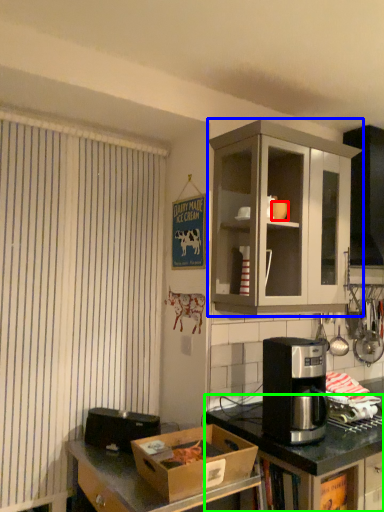
Question: Which is farther away from coffee cup (highlighted by a red box)? cabinetry (highlighted by a blue box) or counter (highlighted by a green box)?

Choices:
 (A) cabinetry
 (B) counter

Answer: (B)